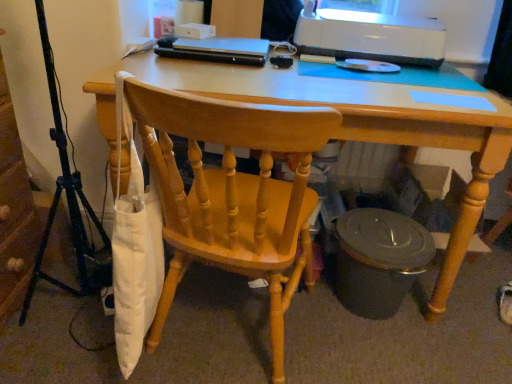
You are a GUI agent. You are given a task and a screenshot of the screen. Output one action in this format:
    pyautogui.click(x=<x>, y=<y>)
    Task: Click on the empty space that is to the right of matte black trash can at lower right
    The image size is (512, 384).
    Given the screenshot: What is the action you would take?
    pyautogui.click(x=466, y=323)